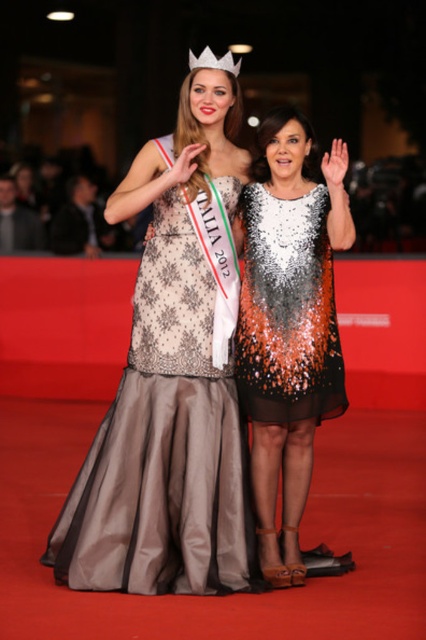
Question: From the image, what is the correct spatial relationship of matte lace dress at center in relation to matte black dress at center?

Choices:
 (A) right
 (B) left

Answer: (A)

Question: Considering the relative positions of matte black dress at left and white plastic crown at upper center in the image provided, where is matte black dress at left located with respect to white plastic crown at upper center?

Choices:
 (A) above
 (B) below

Answer: (B)

Question: Which object is the farthest from the matte black dress at center?

Choices:
 (A) matte lace dress at center
 (B) white plastic crown at upper center
 (C) sparkly sequined dress at center

Answer: (B)

Question: Is sparkly sequined dress at center closer to the viewer compared to shimmering sequined dress at center?

Choices:
 (A) no
 (B) yes

Answer: (B)

Question: Considering the real-world distances, which object is closest to the shimmering sequined dress at center?

Choices:
 (A) matte lace dress at center
 (B) matte black dress at center

Answer: (A)

Question: Which object is positioned farthest from the matte black dress at center?

Choices:
 (A) matte lace dress at center
 (B) shimmering sequined dress at center
 (C) white plastic crown at upper center
 (D) matte black dress at left

Answer: (C)